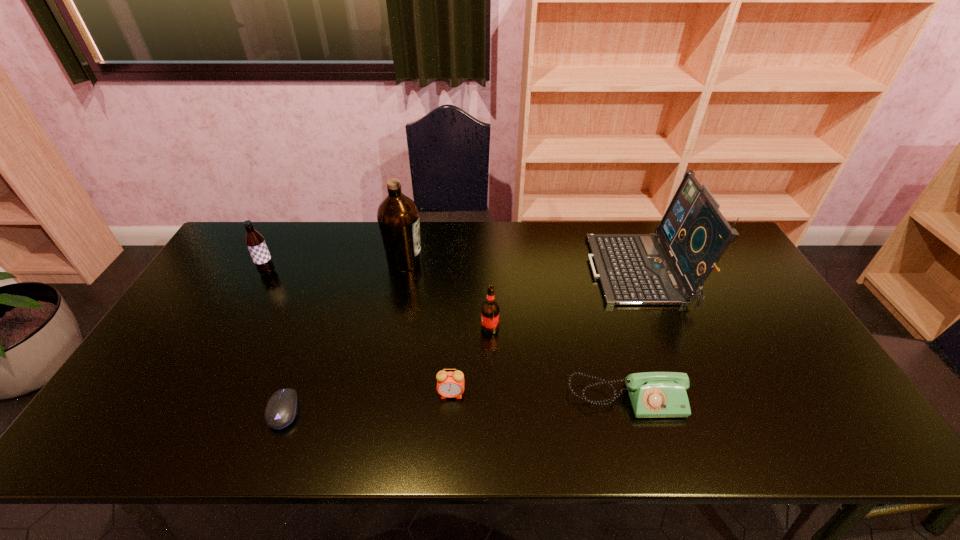
The height and width of the screenshot is (540, 960). Find the location of `vacant space that satisfies the following two spatial constraints: 1. on the label of the olive oil; 2. on the right side of the right root beer`. vacant space that satisfies the following two spatial constraints: 1. on the label of the olive oil; 2. on the right side of the right root beer is located at coordinates (392, 328).

What are the coordinates of `free location that satisfies the following two spatial constraints: 1. on the front-facing side of the laptop computer; 2. on the front side of the computer mouse` in the screenshot? It's located at (697, 410).

Where is `blank space that satisfies the following two spatial constraints: 1. on the front-facing side of the laptop computer; 2. on the dial of the telephone`? blank space that satisfies the following two spatial constraints: 1. on the front-facing side of the laptop computer; 2. on the dial of the telephone is located at coordinates pos(692,399).